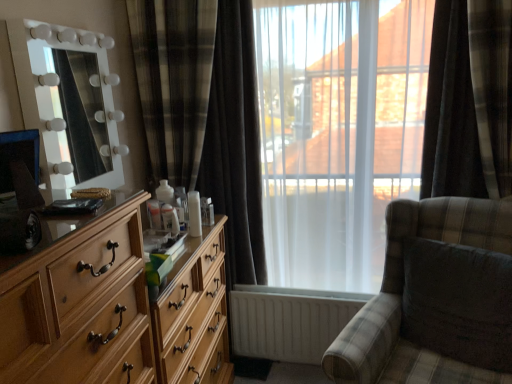
Identify the location of blank space above plaid fabric swivel chair at right (from a real-world perspective). Image resolution: width=512 pixels, height=384 pixels. (461, 254).